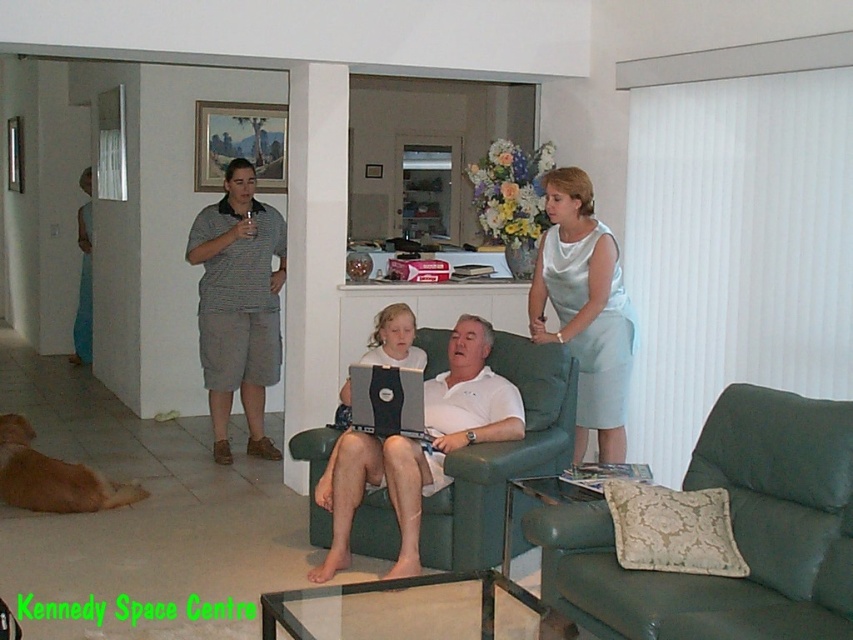
You are standing in the living room and want to place a small potted plant exactly at the point marked as point (732, 532). According to the scene description, where would this point be located?

The point (732, 532) is located on the green leather couch at lower right.

You are standing in the living room and want to reach the point marked as point (408,401) without moving any furniture. Can you walk directly to it?

The distance between you and point (408,401) is 13.45 feet, so yes, you can walk directly to it as there is no obstruction mentioned in the scene description.

You are a visitor in this living room and notice two laptops. The first is the black matte laptop at center and the second is the matte black laptop at center. Which one is closer to you?

The black matte laptop at center is closer to you as it is positioned in front of the matte black laptop at center.